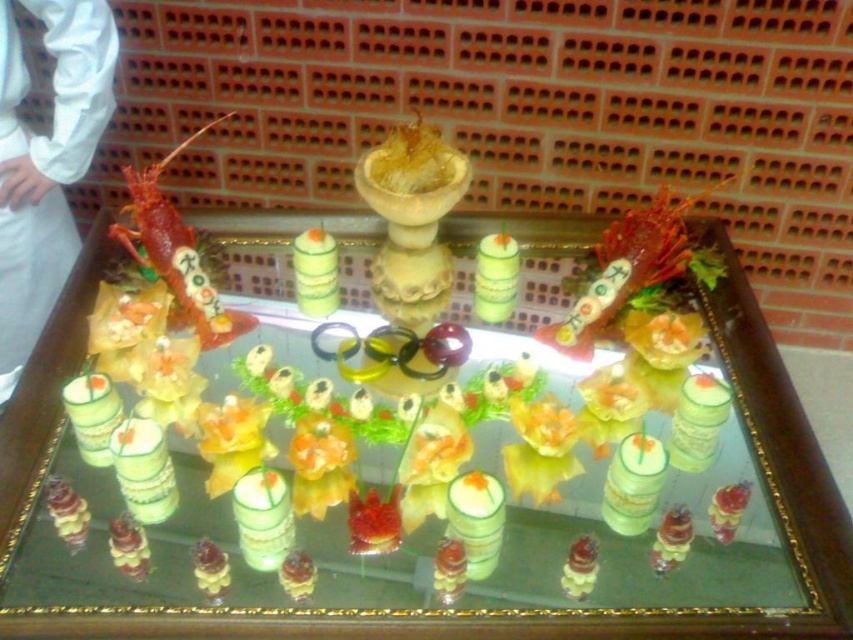
Question: Estimate the real-world distances between objects in this image. Which object is farther from the green plastic tray at center?

Choices:
 (A) golden shredded food at center
 (B) white fabric at left

Answer: (B)

Question: Which object is the closest to the golden shredded food at center?

Choices:
 (A) shiny red lobster at upper left
 (B) green plastic tray at center
 (C) white fabric at left

Answer: (A)

Question: Does green plastic tray at center appear over shiny red lobster at upper left?

Choices:
 (A) no
 (B) yes

Answer: (A)

Question: Which object is farther from the camera taking this photo?

Choices:
 (A) golden shredded food at center
 (B) shiny red lobster at upper left
 (C) green plastic tray at center
 (D) white fabric at left

Answer: (B)

Question: Is the position of shiny red lobster at upper left more distant than that of golden shredded food at center?

Choices:
 (A) no
 (B) yes

Answer: (B)

Question: Is green plastic tray at center above golden shredded food at center?

Choices:
 (A) no
 (B) yes

Answer: (A)